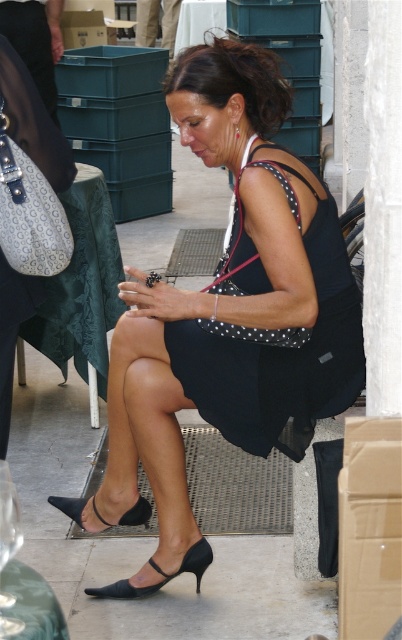
You are a fashion designer observing a woman wearing a black dotted fabric dress at center and a black leather sandal at lower center. Which item of clothing is positioned higher on her body?

The black dotted fabric dress at center is much taller as black leather sandal at lower center, so the dress is positioned higher on her body than the sandal.